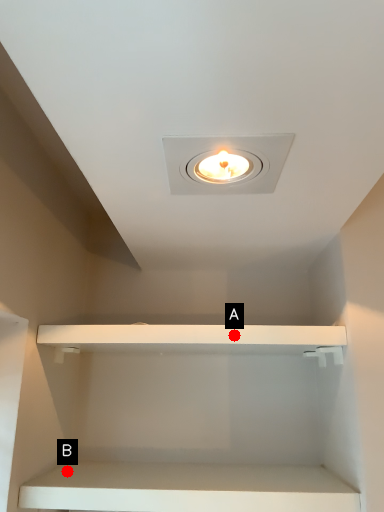
Question: Two points are circled on the image, labeled by A and B beside each circle. Which point is farther from the camera taking this photo?

Choices:
 (A) A is further
 (B) B is further

Answer: (B)